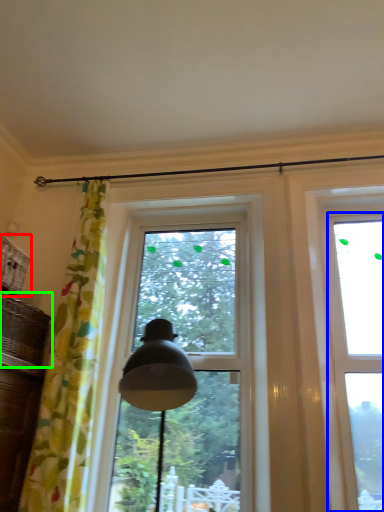
Question: Based on their relative distances, which object is nearer to basket (highlighted by a red box)? Choose from window (highlighted by a blue box) and basket (highlighted by a green box).

Choices:
 (A) window
 (B) basket

Answer: (B)